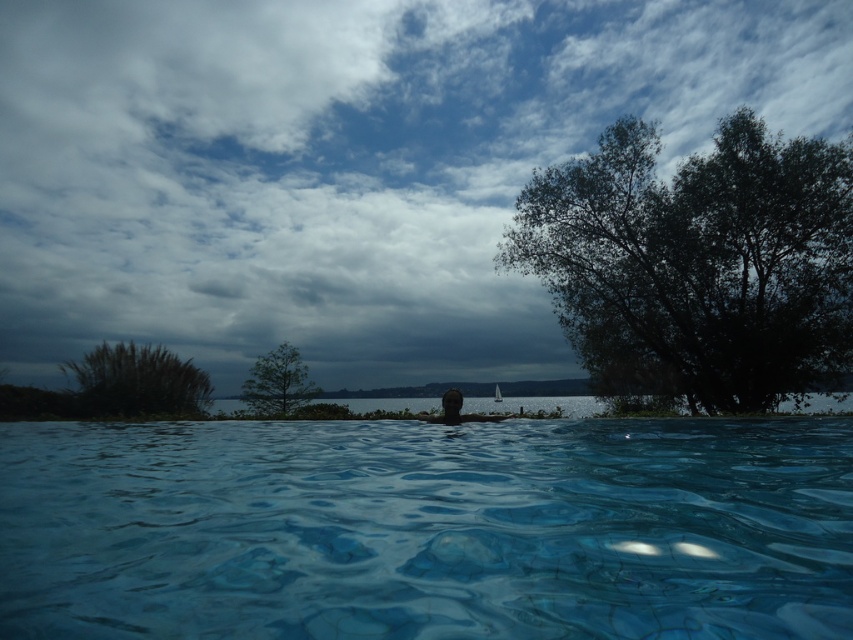
You are an architect designing a new outdoor space and want to ensure that the green leafy tree at right does not block the view of the cloudy sky at upper center from the pool area. Based on the scene, is there a risk that the tree could obstruct the sky view?

The cloudy sky at upper center might be wider than green leafy tree at right, so there is a possibility that the tree could obstruct part of the sky view depending on their relative positions and angles.

You are standing in the serene outdoor scene and want to take a photo of the cloudy sky at upper center and the green grassy bush at upper left. Which object takes up more space in the frame?

The cloudy sky at upper center takes up more space in the frame because it is bigger than the green grassy bush at upper left.